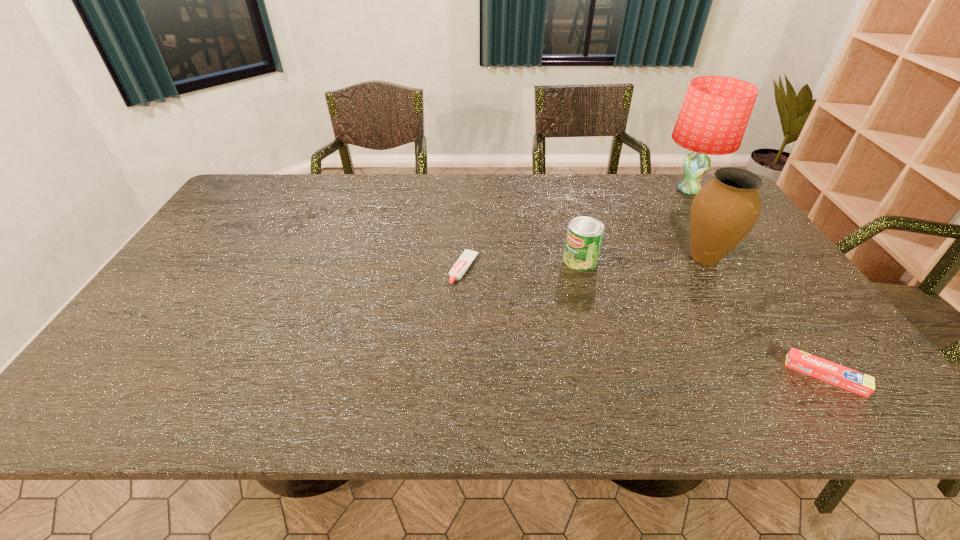
What are the coordinates of `toothpaste positioned at the right edge` in the screenshot? It's located at (849, 379).

This screenshot has width=960, height=540. I want to click on object that is at the far right corner, so click(714, 115).

Locate an element on the screen. object located in the near right corner section of the desktop is located at coordinates (849, 379).

In the image, there is a desktop. Where is `vacant area at the far edge`? The image size is (960, 540). vacant area at the far edge is located at coordinates (459, 179).

Find the location of a particular element. The image size is (960, 540). vacant space at the near edge of the desktop is located at coordinates [x=209, y=397].

Where is `vacant space at the left edge of the desktop`? The height and width of the screenshot is (540, 960). vacant space at the left edge of the desktop is located at coordinates (154, 308).

In the image, there is a desktop. Where is `vacant space at the right edge`? This screenshot has height=540, width=960. vacant space at the right edge is located at coordinates (808, 301).

In the image, there is a desktop. Identify the location of vacant space at the far left corner. The width and height of the screenshot is (960, 540). (281, 185).

Identify the location of vacant space in between the nearer toothpaste and the third shortest object. The image size is (960, 540). (703, 318).

You are a GUI agent. You are given a task and a screenshot of the screen. Output one action in this format:
    pyautogui.click(x=<x>, y=<y>)
    Task: Click on the free space between the second object from left to right and the nearest object
    
    Given the screenshot: What is the action you would take?
    pyautogui.click(x=703, y=318)